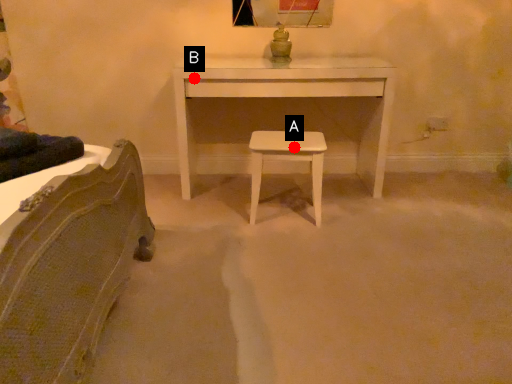
Question: Two points are circled on the image, labeled by A and B beside each circle. Which point is closer to the camera?

Choices:
 (A) A is closer
 (B) B is closer

Answer: (A)